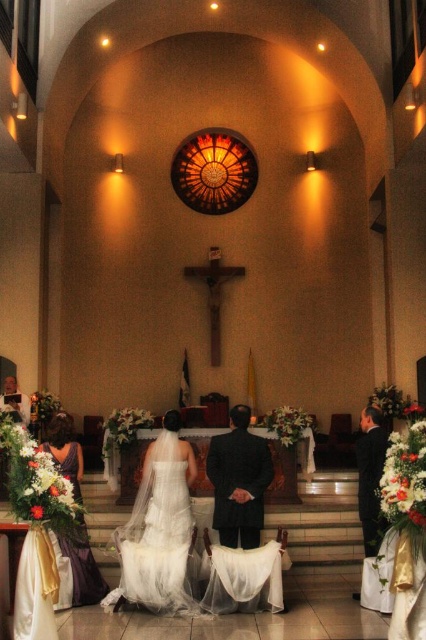
You are a photographer positioned at the front of the church during a wedding. You need to capture a photo of both the dark suit at center and the dark suit at right. Which dark suit should you focus on first to ensure it appears closer in the photo?

The dark suit at center is further to the viewer than dark suit at right, so you should focus on the dark suit at center first to ensure it appears closer in the photo.

You are a photographer standing at the entrance of the church. You need to capture a photo that includes both the dark suit at right and the smooth white shirt at lower left. Which object should you focus on first if you want to ensure both are in the frame without moving the camera?

You should focus on the dark suit at right first because it is taller than the smooth white shirt at lower left, so adjusting the camera angle to include its height will naturally include the shorter smooth white shirt at lower left as well.